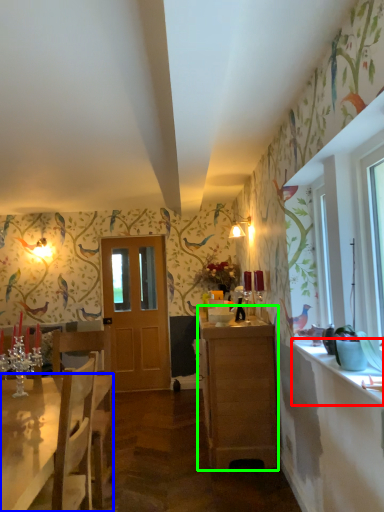
Question: Which object is positioned closest to counter top (highlighted by a red box)? Select from desk (highlighted by a blue box) and cabinetry (highlighted by a green box).

Choices:
 (A) desk
 (B) cabinetry

Answer: (B)